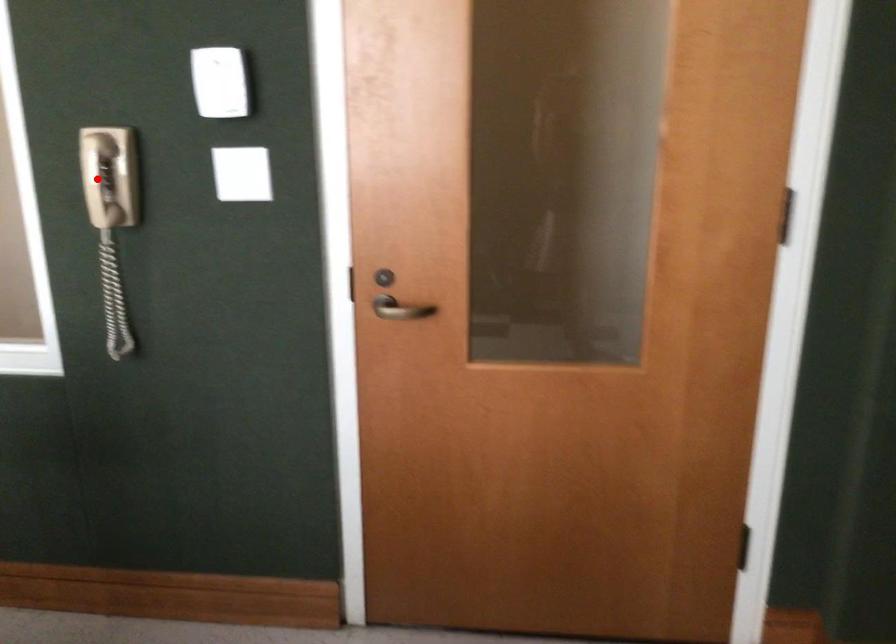
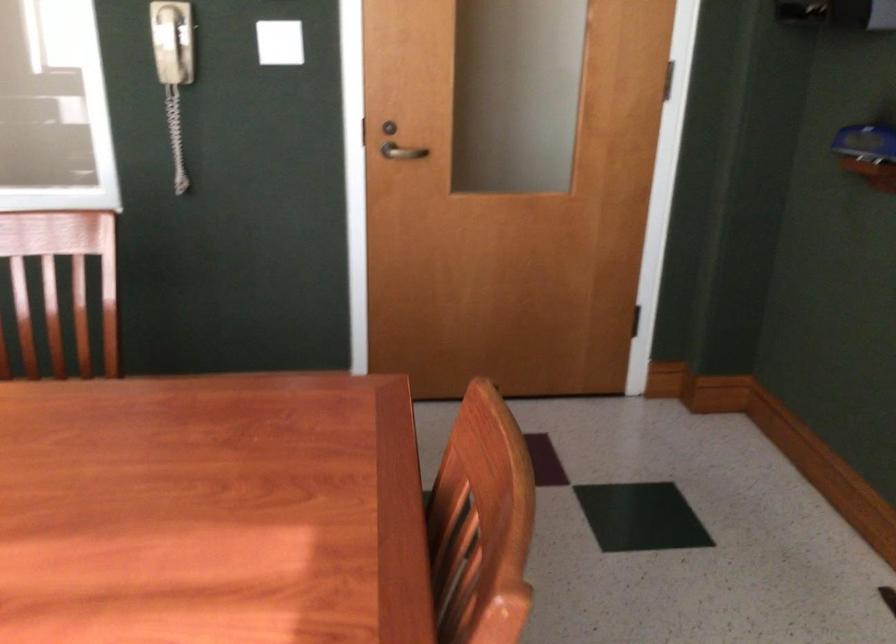
Find the pixel in the second image that matches the highlighted location in the first image.

(171, 41)